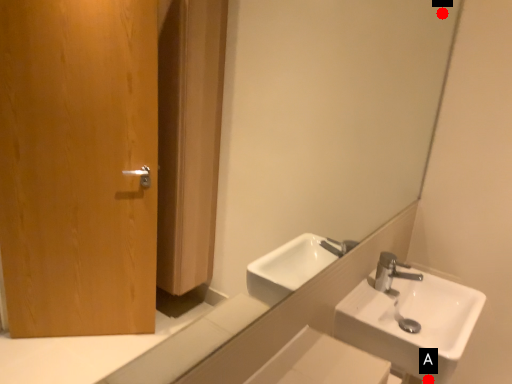
Question: Two points are circled on the image, labeled by A and B beside each circle. Among these points, which one is nearest to the camera?

Choices:
 (A) A is closer
 (B) B is closer

Answer: (A)